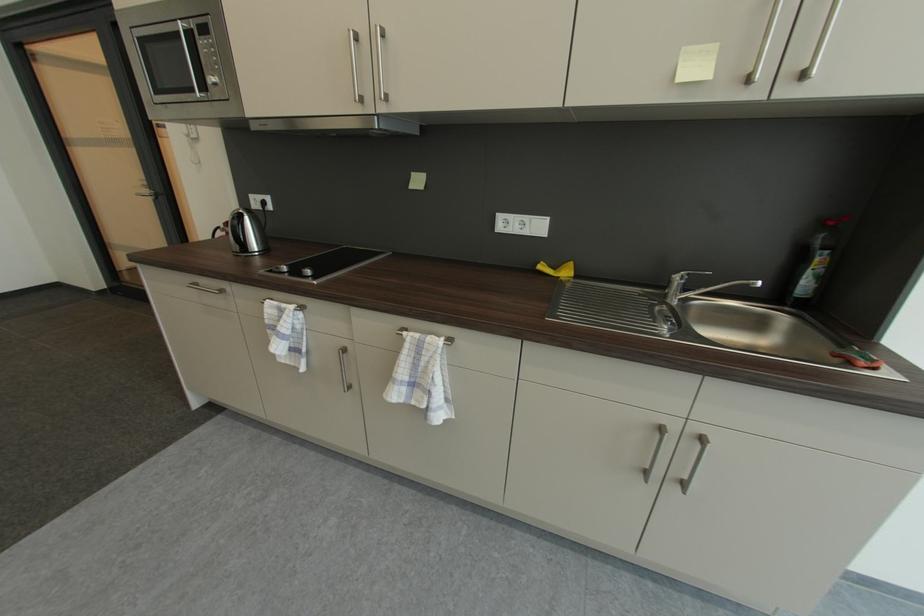
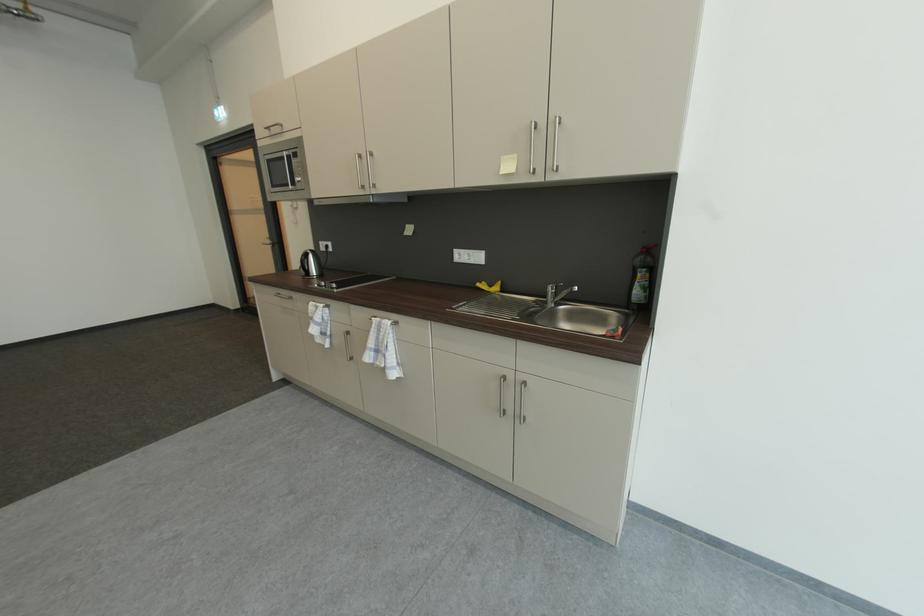
Locate, in the second image, the point that corresponds to point (258, 198) in the first image.

(327, 245)